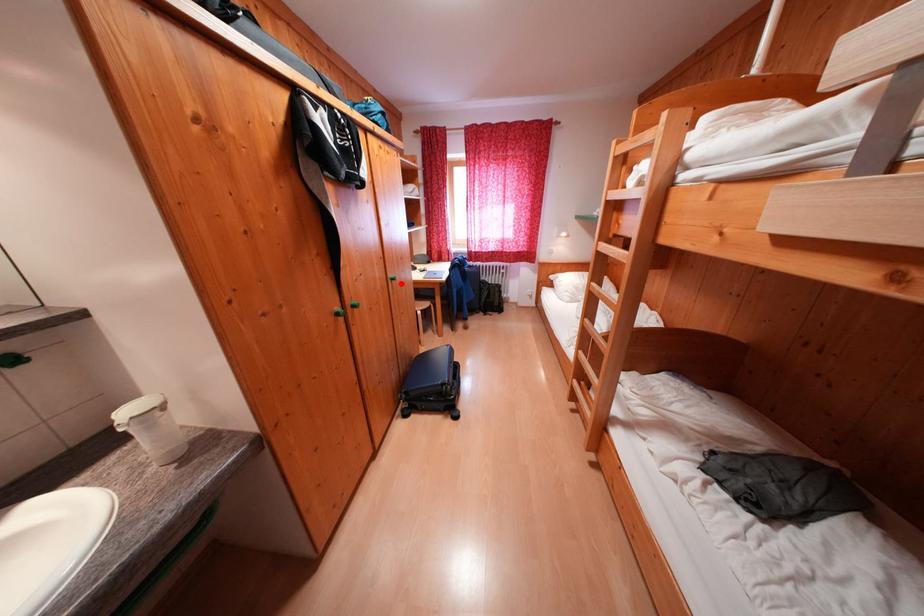
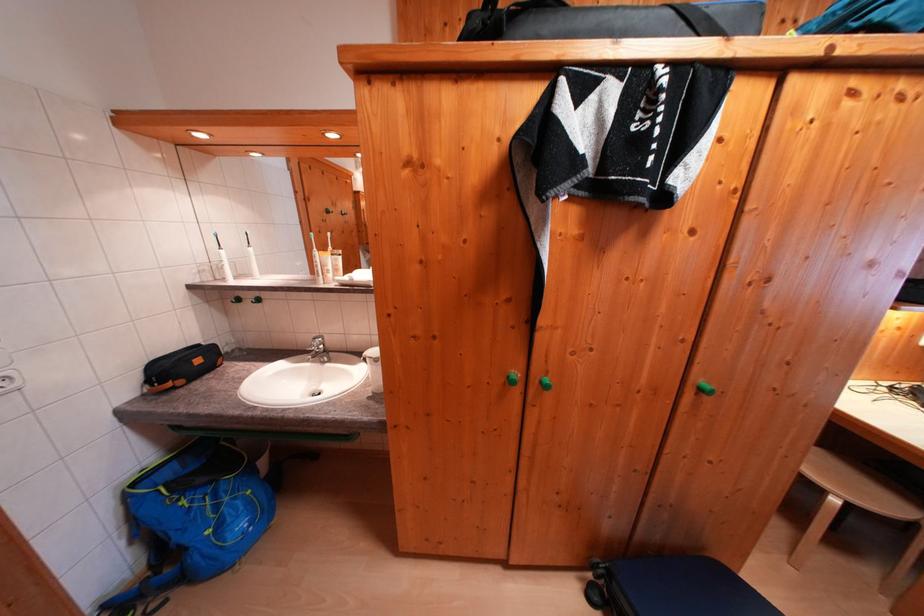
Question: I am providing you with two images of the same scene from different viewpoints. Given a red point in image1, look at the same physical point in image2. Is it:

Choices:
 (A) Closer to the viewpoint
 (B) Farther from the viewpoint

Answer: (B)